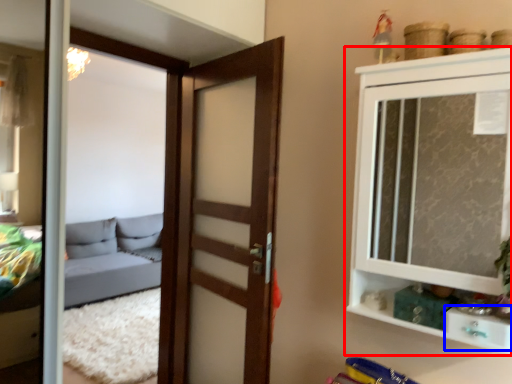
Question: Among these objects, which one is farthest to the camera, cupboard (highlighted by a red box) or drawer (highlighted by a blue box)?

Choices:
 (A) cupboard
 (B) drawer

Answer: (B)